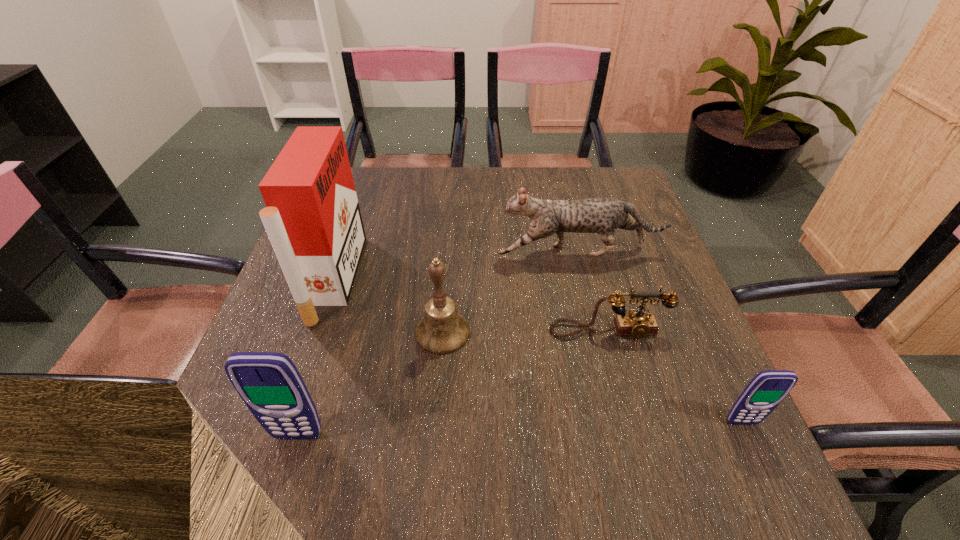
The image size is (960, 540). In order to click on the nearest object in this screenshot , I will do `click(269, 383)`.

Where is `the left cellular telephone`? The image size is (960, 540). the left cellular telephone is located at coordinates (269, 383).

Locate an element on the screen. This screenshot has width=960, height=540. the right cellular telephone is located at coordinates (767, 389).

Find the location of a particular element. the farther cellular telephone is located at coordinates (767, 389).

You are a GUI agent. You are given a task and a screenshot of the screen. Output one action in this format:
    pyautogui.click(x=<x>, y=<y>)
    Task: Click on the bell
    The height and width of the screenshot is (540, 960).
    Given the screenshot: What is the action you would take?
    pyautogui.click(x=442, y=330)

At what (x,y) coordinates should I click in order to perform the action: click on cat. Please return your answer as a coordinate pair (x, y). This screenshot has width=960, height=540. Looking at the image, I should click on (602, 216).

I want to click on the tallest object, so click(312, 217).

Identify the location of telephone. This screenshot has width=960, height=540. (637, 323).

In order to click on vacant space located on the back of the bell in this screenshot , I will do `click(446, 277)`.

You are a GUI agent. You are given a task and a screenshot of the screen. Output one action in this format:
    pyautogui.click(x=<x>, y=<y>)
    Task: Click on the vacant space positioned on the face of the cat
    
    Given the screenshot: What is the action you would take?
    pyautogui.click(x=434, y=252)